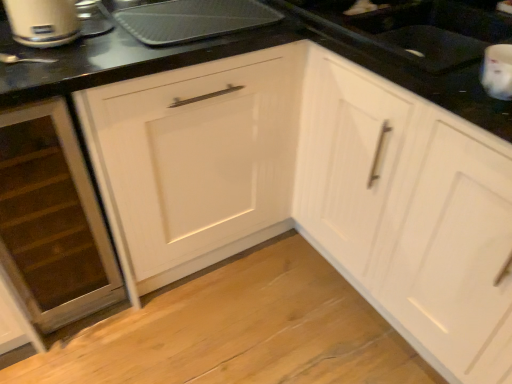
Question: Can you confirm if matte silver toaster at upper left is thinner than metallic silver tray at upper center?

Choices:
 (A) no
 (B) yes

Answer: (B)

Question: Is matte silver toaster at upper left shorter than metallic silver tray at upper center?

Choices:
 (A) yes
 (B) no

Answer: (B)

Question: Is matte silver toaster at upper left wider than metallic silver tray at upper center?

Choices:
 (A) no
 (B) yes

Answer: (A)

Question: Is metallic silver tray at upper center completely or partially inside matte silver toaster at upper left?

Choices:
 (A) yes
 (B) no

Answer: (B)

Question: Is matte silver toaster at upper left positioned in front of metallic silver tray at upper center?

Choices:
 (A) yes
 (B) no

Answer: (A)

Question: From the image's perspective, is metallic silver tray at upper center above or below white glossy cabinet at center, the 2th cabinetry viewed from the left?

Choices:
 (A) above
 (B) below

Answer: (A)

Question: Does point (154, 26) appear closer or farther from the camera than point (508, 251)?

Choices:
 (A) closer
 (B) farther

Answer: (B)

Question: Is metallic silver tray at upper center wider or thinner than white glossy cabinet at center, which appears as the first cabinetry when viewed from the right?

Choices:
 (A) thin
 (B) wide

Answer: (A)

Question: Considering the positions of metallic silver tray at upper center and white glossy cabinet at center, the 2th cabinetry viewed from the left, in the image, is metallic silver tray at upper center taller or shorter than white glossy cabinet at center, the 2th cabinetry viewed from the left,?

Choices:
 (A) short
 (B) tall

Answer: (A)

Question: Is wooden drawer at lower left, which is counted as the 1th cabinetry, starting from the left, spatially inside white glossy sink at upper right, or outside of it?

Choices:
 (A) outside
 (B) inside

Answer: (A)

Question: Is wooden drawer at lower left, which is counted as the 1th cabinetry, starting from the left, to the left or to the right of white glossy sink at upper right in the image?

Choices:
 (A) right
 (B) left

Answer: (B)

Question: Considering their positions, is wooden drawer at lower left, marked as the second cabinetry in a right-to-left arrangement, located in front of or behind white glossy sink at upper right?

Choices:
 (A) behind
 (B) front

Answer: (B)

Question: In terms of height, does wooden drawer at lower left, which is counted as the 1th cabinetry, starting from the left, look taller or shorter compared to white glossy sink at upper right?

Choices:
 (A) short
 (B) tall

Answer: (B)

Question: Looking at their shapes, would you say matte silver toaster at upper left is wider or thinner than white glossy cabinet at center, which appears as the first cabinetry when viewed from the right?

Choices:
 (A) thin
 (B) wide

Answer: (A)

Question: Is matte silver toaster at upper left bigger or smaller than white glossy cabinet at center, which appears as the first cabinetry when viewed from the right?

Choices:
 (A) big
 (B) small

Answer: (B)